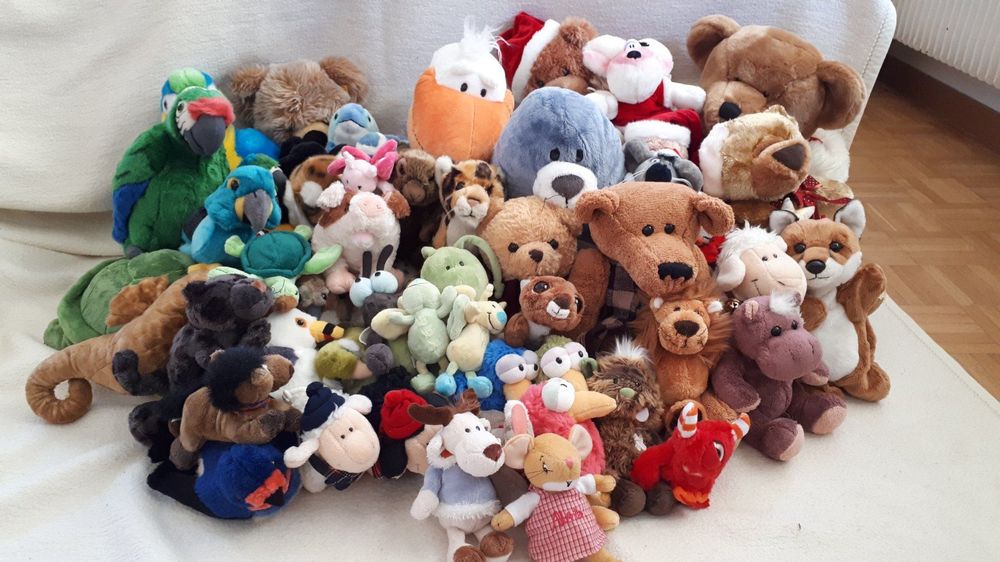
Find the location of a particular element. Image resolution: width=1000 pixels, height=562 pixels. plush bears is located at coordinates (757, 83), (751, 151), (561, 52), (658, 213), (530, 229).